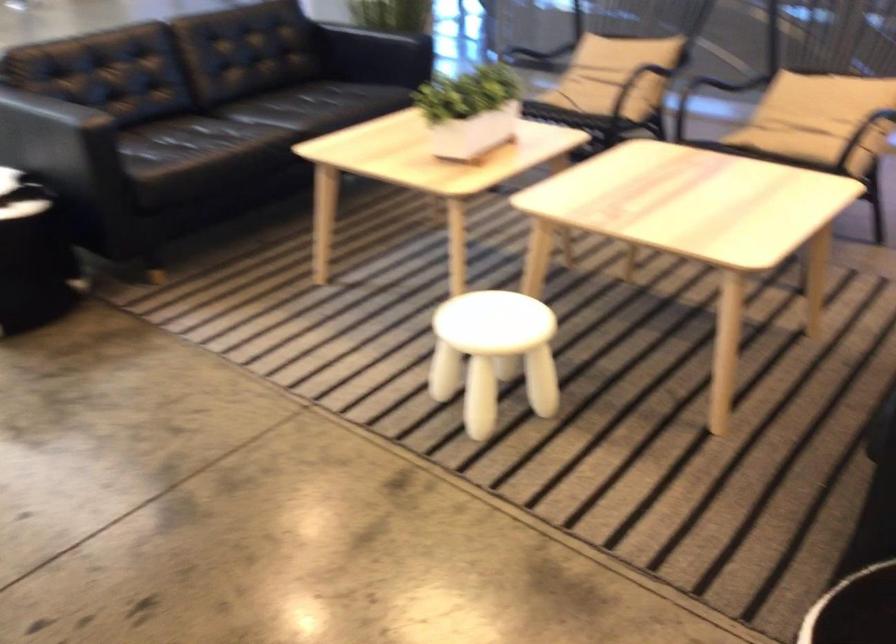
Describe the element at coordinates (31, 115) in the screenshot. I see `the sofa armrest` at that location.